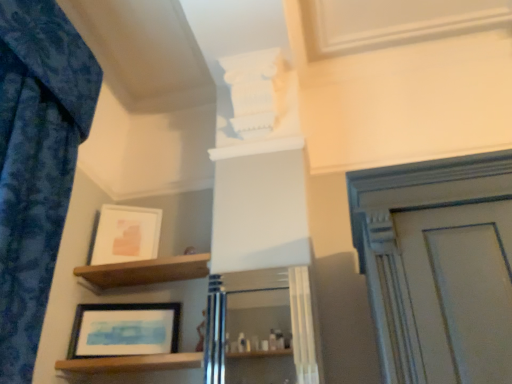
What do you see at coordinates (260, 328) in the screenshot? I see `white glossy cabinet at center` at bounding box center [260, 328].

Identify the location of matte black picture frame at lower left, the 2th picture frame viewed from the top. (124, 330).

The width and height of the screenshot is (512, 384). Describe the element at coordinates (36, 163) in the screenshot. I see `blue fabric curtain at left` at that location.

What is the approximate width of matte white picture frame at upper left, which is the 1th picture frame in back-to-front order?

matte white picture frame at upper left, which is the 1th picture frame in back-to-front order, is 0.89 inches wide.

Identify the location of white glossy cabinet at center. (260, 328).

Does white glossy cabinet at center have a lesser width compared to matte black picture frame at lower left, the first picture frame viewed from the front?

Correct, the width of white glossy cabinet at center is less than that of matte black picture frame at lower left, the first picture frame viewed from the front.

From a real-world perspective, between white glossy cabinet at center and matte black picture frame at lower left, the first picture frame viewed from the front, who is vertically lower?

From a 3D spatial view, white glossy cabinet at center is below.

Can you confirm if white glossy cabinet at center is positioned to the left of matte black picture frame at lower left, acting as the second picture frame starting from the back?

No.

From a real-world perspective, who is located higher, white glossy cabinet at center or wooden at lower left, which is counted as the 2th shelf, starting from the top?

white glossy cabinet at center.

Consider the image. Is white glossy cabinet at center oriented towards wooden at lower left, which appears as the first shelf when ordered from the bottom?

No, white glossy cabinet at center does not turn towards wooden at lower left, which appears as the first shelf when ordered from the bottom.

What's the angular difference between white glossy cabinet at center and wooden at lower left, which appears as the first shelf when ordered from the bottom,'s facing directions?

The angular difference between white glossy cabinet at center and wooden at lower left, which appears as the first shelf when ordered from the bottom, is 3.13 degrees.

Considering the relative sizes of white glossy cabinet at center and wooden at lower left, which appears as the first shelf when ordered from the bottom, in the image provided, is white glossy cabinet at center smaller than wooden at lower left, which appears as the first shelf when ordered from the bottom,?

Indeed, white glossy cabinet at center has a smaller size compared to wooden at lower left, which appears as the first shelf when ordered from the bottom.

Would you say matte white picture frame at upper left, which is the 2th picture frame from bottom to top, is to the left or to the right of blue fabric curtain at left in the picture?

matte white picture frame at upper left, which is the 2th picture frame from bottom to top, is positioned on blue fabric curtain at left's right side.

Looking at this image, which object is thinner, matte white picture frame at upper left, which is the 1th picture frame in back-to-front order, or blue fabric curtain at left?

Thinner between the two is matte white picture frame at upper left, which is the 1th picture frame in back-to-front order.

From the image's perspective, which one is positioned lower, matte white picture frame at upper left, which is the 2th picture frame from bottom to top, or blue fabric curtain at left?

From the image's view, matte white picture frame at upper left, which is the 2th picture frame from bottom to top, is below.

From a real-world perspective, is matte white picture frame at upper left, the second picture frame when ordered from front to back, on blue fabric curtain at left?

Correct, in the physical world, matte white picture frame at upper left, the second picture frame when ordered from front to back, is higher than blue fabric curtain at left.

Would you say wooden at lower left, which appears as the first shelf when ordered from the bottom, is outside blue fabric curtain at left?

Yes, wooden at lower left, which appears as the first shelf when ordered from the bottom, is located beyond the bounds of blue fabric curtain at left.

Is wooden at lower left, which appears as the first shelf when ordered from the bottom, shorter than blue fabric curtain at left?

Yes, wooden at lower left, which appears as the first shelf when ordered from the bottom, is shorter than blue fabric curtain at left.

Is point (174, 354) closer to camera compared to point (3, 67)?

No.

In the image, is wooden at lower left, which is counted as the 2th shelf, starting from the top, on the left side or the right side of blue fabric curtain at left?

Based on their positions, wooden at lower left, which is counted as the 2th shelf, starting from the top, is located to the right of blue fabric curtain at left.

Is blue fabric curtain at left looking in the opposite direction of matte black picture frame at lower left, which is the first picture frame in bottom-to-top order?

No, matte black picture frame at lower left, which is the first picture frame in bottom-to-top order, is not at the back of blue fabric curtain at left.

Which object is positioned more to the right, blue fabric curtain at left or matte black picture frame at lower left, the 2th picture frame viewed from the top?

matte black picture frame at lower left, the 2th picture frame viewed from the top, is more to the right.

From the image's perspective, which one is positioned higher, blue fabric curtain at left or matte black picture frame at lower left, which is the first picture frame in bottom-to-top order?

blue fabric curtain at left.

Identify the location of the 1st picture frame behind when counting from the blue fabric curtain at left. (124, 330).

Is brown wooden shelf at upper center, arranged as the first shelf when viewed from the top, located within white glossy cabinet at center?

No, brown wooden shelf at upper center, arranged as the first shelf when viewed from the top, is located outside of white glossy cabinet at center.

In terms of width, does white glossy cabinet at center look wider or thinner when compared to brown wooden shelf at upper center, arranged as the first shelf when viewed from the top?

white glossy cabinet at center is thinner than brown wooden shelf at upper center, arranged as the first shelf when viewed from the top.

Is there a large distance between white glossy cabinet at center and brown wooden shelf at upper center, arranged as the first shelf when viewed from the top?

Yes.

Can you confirm if white glossy cabinet at center is smaller than brown wooden shelf at upper center, the 2th shelf when ordered from bottom to top?

Yes.

Consider the image. Is matte white picture frame at upper left, placed as the 1th picture frame when sorted from top to bottom, thinner than matte black picture frame at lower left, the first picture frame viewed from the front?

Yes, matte white picture frame at upper left, placed as the 1th picture frame when sorted from top to bottom, is thinner than matte black picture frame at lower left, the first picture frame viewed from the front.

Is matte white picture frame at upper left, placed as the 1th picture frame when sorted from top to bottom, taller or shorter than matte black picture frame at lower left, the 2th picture frame viewed from the top?

matte white picture frame at upper left, placed as the 1th picture frame when sorted from top to bottom, is taller than matte black picture frame at lower left, the 2th picture frame viewed from the top.

Which object is more forward, matte white picture frame at upper left, which is the 2th picture frame from bottom to top, or matte black picture frame at lower left, the 2th picture frame viewed from the top?

matte black picture frame at lower left, the 2th picture frame viewed from the top.

From the image's perspective, relative to matte black picture frame at lower left, which is the first picture frame in bottom-to-top order, is matte white picture frame at upper left, which is the 2th picture frame from bottom to top, above or below?

Based on their image positions, matte white picture frame at upper left, which is the 2th picture frame from bottom to top, is located above matte black picture frame at lower left, which is the first picture frame in bottom-to-top order.

I want to click on the 1st picture frame behind the white glossy cabinet at center, starting your count from the anchor, so point(124,330).

Where is `shelf that is under the white glossy cabinet at center (from a real-world perspective)`? shelf that is under the white glossy cabinet at center (from a real-world perspective) is located at coordinates (132, 363).

Looking at the image, which one is located further to blue fabric curtain at left, white glossy cabinet at center or wooden at lower left, which is counted as the 2th shelf, starting from the top?

white glossy cabinet at center is further to blue fabric curtain at left.

When comparing their distances from matte white picture frame at upper left, the second picture frame when ordered from front to back, does matte black picture frame at lower left, the 2th picture frame viewed from the top, or blue fabric curtain at left seem closer?

Based on the image, matte black picture frame at lower left, the 2th picture frame viewed from the top, appears to be nearer to matte white picture frame at upper left, the second picture frame when ordered from front to back.

When comparing their distances from matte white picture frame at upper left, the second picture frame when ordered from front to back, does brown wooden shelf at upper center, the 2th shelf when ordered from bottom to top, or blue fabric curtain at left seem further?

Among the two, blue fabric curtain at left is located further to matte white picture frame at upper left, the second picture frame when ordered from front to back.

Considering their positions, is matte black picture frame at lower left, acting as the second picture frame starting from the back, positioned closer to white glossy cabinet at center than brown wooden shelf at upper center, arranged as the first shelf when viewed from the top?

matte black picture frame at lower left, acting as the second picture frame starting from the back, is positioned closer to the anchor white glossy cabinet at center.

Based on their spatial positions, is white glossy cabinet at center or matte white picture frame at upper left, which is the 1th picture frame in back-to-front order, closer to wooden at lower left, which is counted as the 2th shelf, starting from the top?

matte white picture frame at upper left, which is the 1th picture frame in back-to-front order, lies closer to wooden at lower left, which is counted as the 2th shelf, starting from the top, than the other object.

Looking at the image, which one is located further to brown wooden shelf at upper center, arranged as the first shelf when viewed from the top, matte white picture frame at upper left, which is the 2th picture frame from bottom to top, or white glossy cabinet at center?

white glossy cabinet at center.

When comparing their distances from blue fabric curtain at left, does white glossy cabinet at center or brown wooden shelf at upper center, arranged as the first shelf when viewed from the top, seem further?

white glossy cabinet at center.

When comparing their distances from matte black picture frame at lower left, the first picture frame viewed from the front, does white glossy cabinet at center or brown wooden shelf at upper center, the 2th shelf when ordered from bottom to top, seem further?

Among the two, white glossy cabinet at center is located further to matte black picture frame at lower left, the first picture frame viewed from the front.

Locate an element on the screen. Image resolution: width=512 pixels, height=384 pixels. cabinetry between blue fabric curtain at left and matte white picture frame at upper left, which is the 1th picture frame in back-to-front order, in the front-back direction is located at coordinates pyautogui.click(x=260, y=328).

Where is `cabinetry positioned between blue fabric curtain at left and matte black picture frame at lower left, the first picture frame viewed from the front, from near to far`? cabinetry positioned between blue fabric curtain at left and matte black picture frame at lower left, the first picture frame viewed from the front, from near to far is located at coordinates (260, 328).

Image resolution: width=512 pixels, height=384 pixels. What are the coordinates of `picture frame between matte white picture frame at upper left, placed as the 1th picture frame when sorted from top to bottom, and white glossy cabinet at center from left to right` in the screenshot? It's located at (124, 330).

The width and height of the screenshot is (512, 384). In order to click on picture frame between brown wooden shelf at upper center, arranged as the first shelf when viewed from the top, and wooden at lower left, which is counted as the 2th shelf, starting from the top, in the vertical direction in this screenshot , I will do `click(124, 330)`.